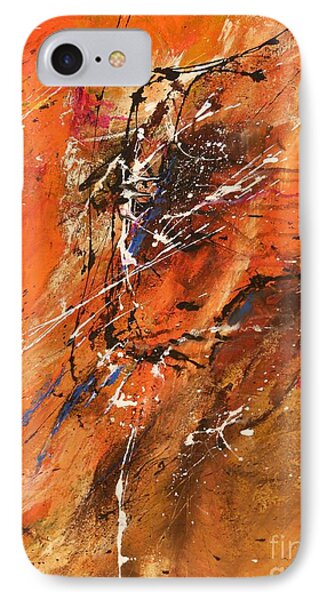
Where is `light source`? Image resolution: width=327 pixels, height=600 pixels. light source is located at coordinates (117, 60).